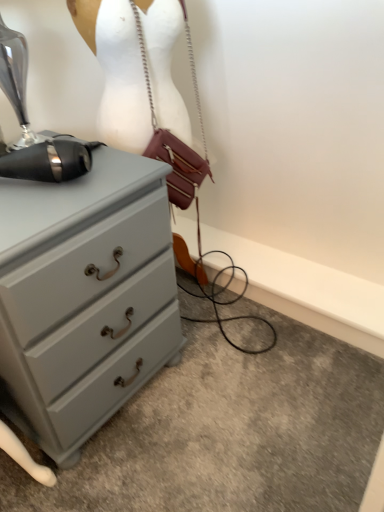
What is the approximate width of leather/metallic handbag at center?

15.85 centimeters.

Measure the distance between point [195,169] and camera.

Point [195,169] and camera are 4.15 feet apart.

At what (x,y) coordinates should I click in order to perform the action: click on black metallic sewing machine at upper left. Please return your answer as a coordinate pair (x, y). Image resolution: width=384 pixels, height=512 pixels. Looking at the image, I should click on (31, 130).

Considering the sizes of objects leather/metallic handbag at center and white matte mannequin at upper center in the image provided, who is bigger, leather/metallic handbag at center or white matte mannequin at upper center?

Bigger between the two is white matte mannequin at upper center.

Based on the photo, is leather/metallic handbag at center in contact with white matte mannequin at upper center?

Yes, leather/metallic handbag at center and white matte mannequin at upper center clearly make contact.

Is leather/metallic handbag at center closer to camera compared to white matte mannequin at upper center?

Yes.

Can you tell me how much leather/metallic handbag at center and white matte mannequin at upper center differ in facing direction?

The angle between the facing direction of leather/metallic handbag at center and the facing direction of white matte mannequin at upper center is 4.86 degrees.

Locate an element on the screen. The width and height of the screenshot is (384, 512). sewing machine located in front of the white matte mannequin at upper center is located at coordinates (31, 130).

Which object is positioned more to the left, black metallic sewing machine at upper left or white matte mannequin at upper center?

black metallic sewing machine at upper left.

Which is in front, point (6, 59) or point (203, 164)?

The point (6, 59) is more forward.

Which of these two, black metallic sewing machine at upper left or white matte mannequin at upper center, is bigger?

With larger size is white matte mannequin at upper center.

From a real-world perspective, is white matte mannequin at upper center below black metallic sewing machine at upper left?

Yes.

Is white matte mannequin at upper center behind black metallic sewing machine at upper left?

Yes, white matte mannequin at upper center is further from the camera.

Considering the positions of objects white matte mannequin at upper center and black metallic sewing machine at upper left in the image provided, who is more to the right, white matte mannequin at upper center or black metallic sewing machine at upper left?

white matte mannequin at upper center.

Is point (184, 159) farther from viewer compared to point (69, 170)?

Yes, it is.

From the image's perspective, between matte gray chest of drawers at left and leather/metallic handbag at center, who is located below?

matte gray chest of drawers at left appears lower in the image.

Consider the image. Between matte gray chest of drawers at left and leather/metallic handbag at center, which one is positioned in front?

matte gray chest of drawers at left is in front.

In terms of width, does matte gray chest of drawers at left look wider or thinner when compared to leather/metallic handbag at center?

Clearly, matte gray chest of drawers at left has more width compared to leather/metallic handbag at center.

Considering the sizes of matte gray chest of drawers at left and leather/metallic handbag at center in the image, is matte gray chest of drawers at left taller or shorter than leather/metallic handbag at center?

In the image, matte gray chest of drawers at left appears to be taller than leather/metallic handbag at center.

Which point is more distant from viewer, (204, 272) or (159, 150)?

The point (204, 272) is farther.

From a real-world perspective, which object rests below the other?

white matte mannequin at upper center.

How many degrees apart are the facing directions of white matte mannequin at upper center and leather/metallic handbag at center?

→ There is a 4.86-degree angle between the facing directions of white matte mannequin at upper center and leather/metallic handbag at center.

Which of these two, white matte mannequin at upper center or leather/metallic handbag at center, is smaller?

With smaller size is leather/metallic handbag at center.

From the image's perspective, between matte gray chest of drawers at left and white matte mannequin at upper center, who is located below?

matte gray chest of drawers at left, from the image's perspective.

Does point (153, 331) come in front of point (203, 275)?

Yes.

Which is in front, matte gray chest of drawers at left or white matte mannequin at upper center?

Positioned in front is matte gray chest of drawers at left.

Is matte gray chest of drawers at left oriented away from white matte mannequin at upper center?

matte gray chest of drawers at left does not have its back to white matte mannequin at upper center.

Which object is further away from the camera taking this photo, black metallic sewing machine at upper left or leather/metallic handbag at center?

leather/metallic handbag at center is more distant.

Consider the image. Choose the correct answer: Is black metallic sewing machine at upper left inside leather/metallic handbag at center or outside it?

black metallic sewing machine at upper left lies outside leather/metallic handbag at center.

From a real-world perspective, is black metallic sewing machine at upper left on leather/metallic handbag at center?

Yes.

Which of these two, black metallic sewing machine at upper left or leather/metallic handbag at center, is smaller?

leather/metallic handbag at center.

This screenshot has width=384, height=512. What are the coordinates of `handbag above the white matte mannequin at upper center (from the image's perspective)` in the screenshot? It's located at (176, 137).

The width and height of the screenshot is (384, 512). I want to click on mannequin on the right of black metallic sewing machine at upper left, so click(172, 134).

When comparing their distances from white matte mannequin at upper center, does leather/metallic handbag at center or black metallic sewing machine at upper left seem closer?

leather/metallic handbag at center.

Which object lies further to the anchor point black metallic sewing machine at upper left, leather/metallic handbag at center or matte gray chest of drawers at left?

Based on the image, matte gray chest of drawers at left appears to be further to black metallic sewing machine at upper left.

Estimate the real-world distances between objects in this image. Which object is further from white matte mannequin at upper center, black metallic sewing machine at upper left or matte gray chest of drawers at left?

matte gray chest of drawers at left is further to white matte mannequin at upper center.

Based on their spatial positions, is leather/metallic handbag at center or white matte mannequin at upper center closer to matte gray chest of drawers at left?

white matte mannequin at upper center is positioned closer to the anchor matte gray chest of drawers at left.

Based on their spatial positions, is matte gray chest of drawers at left or leather/metallic handbag at center closer to white matte mannequin at upper center?

leather/metallic handbag at center lies closer to white matte mannequin at upper center than the other object.

In the scene shown: Which object lies nearer to the anchor point matte gray chest of drawers at left, leather/metallic handbag at center or black metallic sewing machine at upper left?

Among the two, black metallic sewing machine at upper left is located nearer to matte gray chest of drawers at left.

When comparing their distances from black metallic sewing machine at upper left, does matte gray chest of drawers at left or white matte mannequin at upper center seem further?

matte gray chest of drawers at left lies further to black metallic sewing machine at upper left than the other object.

Consider the image. From the image, which object appears to be nearer to white matte mannequin at upper center, black metallic sewing machine at upper left or leather/metallic handbag at center?

Among the two, leather/metallic handbag at center is located nearer to white matte mannequin at upper center.

Where is `mannequin between black metallic sewing machine at upper left and matte gray chest of drawers at left in the vertical direction`? mannequin between black metallic sewing machine at upper left and matte gray chest of drawers at left in the vertical direction is located at coordinates (172, 134).

In order to click on mannequin between leather/metallic handbag at center and matte gray chest of drawers at left vertically in this screenshot , I will do `click(172, 134)`.

This screenshot has width=384, height=512. In order to click on mannequin between black metallic sewing machine at upper left and leather/metallic handbag at center from left to right in this screenshot , I will do [172, 134].

I want to click on sewing machine between leather/metallic handbag at center and matte gray chest of drawers at left in the up-down direction, so click(x=31, y=130).